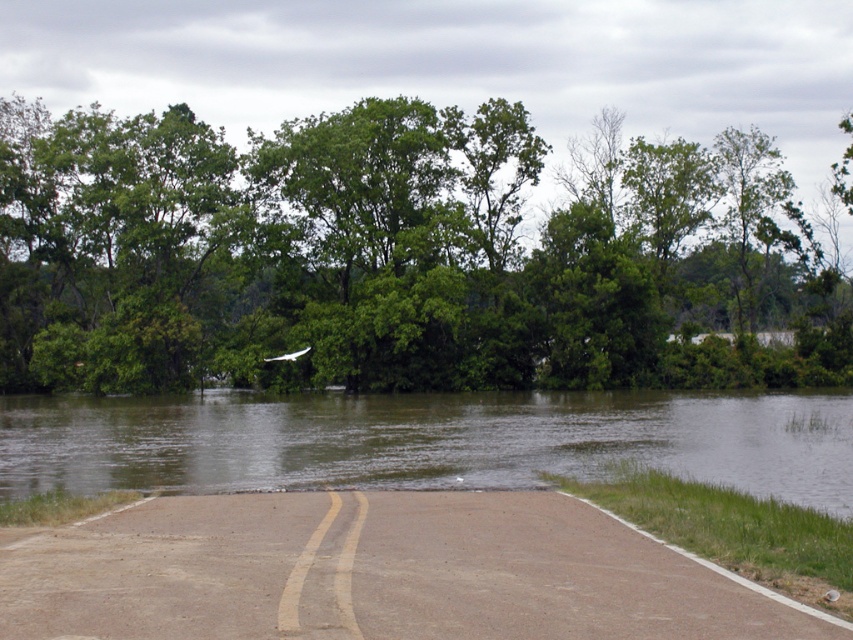
From the picture: Can you confirm if green leafy tree at upper center is shorter than brown muddy water at center?

No, green leafy tree at upper center is not shorter than brown muddy water at center.

Is green leafy tree at upper center above brown muddy water at center?

Indeed, green leafy tree at upper center is positioned over brown muddy water at center.

Where is `green leafy tree at upper center`? The height and width of the screenshot is (640, 853). green leafy tree at upper center is located at coordinates (397, 256).

Identify the location of green leafy tree at upper center. This screenshot has height=640, width=853. (397, 256).